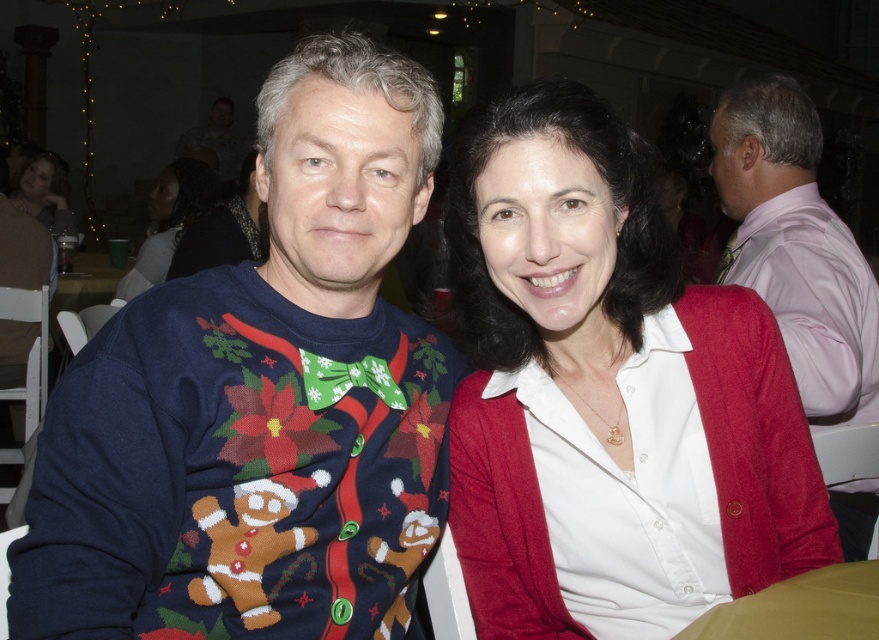
Question: Does brown leather table at lower right appear on the left side of matte black hair at upper left?

Choices:
 (A) no
 (B) yes

Answer: (A)

Question: Is pink satin shirt at right wider than dark brown hair at upper left?

Choices:
 (A) no
 (B) yes

Answer: (A)

Question: Can you confirm if pink satin shirt at right is positioned above dark brown hair at upper left?

Choices:
 (A) yes
 (B) no

Answer: (B)

Question: Which point is farther to the camera?

Choices:
 (A) brown leather table at lower right
 (B) knitted sweater at center
 (C) pink satin shirt at right

Answer: (C)

Question: Which object appears closest to the camera in this image?

Choices:
 (A) white matte shirt at center
 (B) dark brown hair at upper left
 (C) knitted sweater at center
 (D) matte black hair at upper left

Answer: (C)

Question: Estimate the real-world distances between objects in this image. Which object is farther from the pink satin shirt at right?

Choices:
 (A) matte black hair at upper left
 (B) white matte shirt at center
 (C) dark brown hair at upper left

Answer: (A)